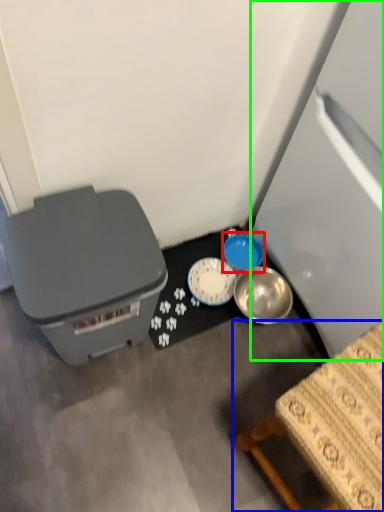
Question: Which is nearer to the bowl (highlighted by a red box)? furniture (highlighted by a blue box) or refrigerator (highlighted by a green box).

Choices:
 (A) furniture
 (B) refrigerator

Answer: (B)